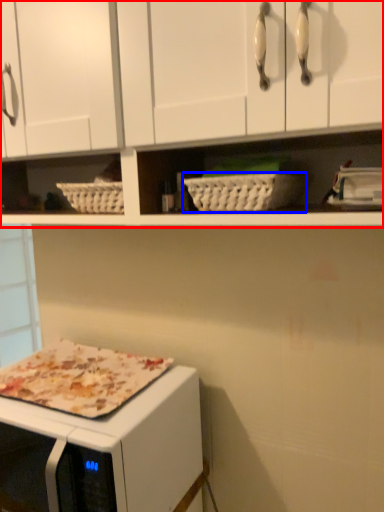
Question: Among these objects, which one is farthest to the camera, cabinetry (highlighted by a red box) or basket (highlighted by a blue box)?

Choices:
 (A) cabinetry
 (B) basket

Answer: (B)